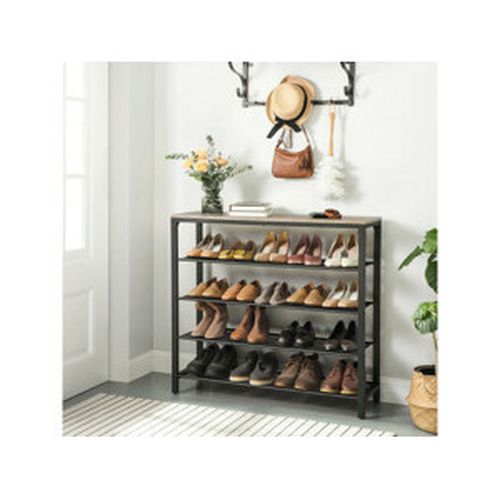
The height and width of the screenshot is (500, 500). Identify the location of shoes on bottom shelf. (197, 369), (213, 368), (238, 373), (260, 378), (284, 377), (329, 385), (349, 388), (303, 381).